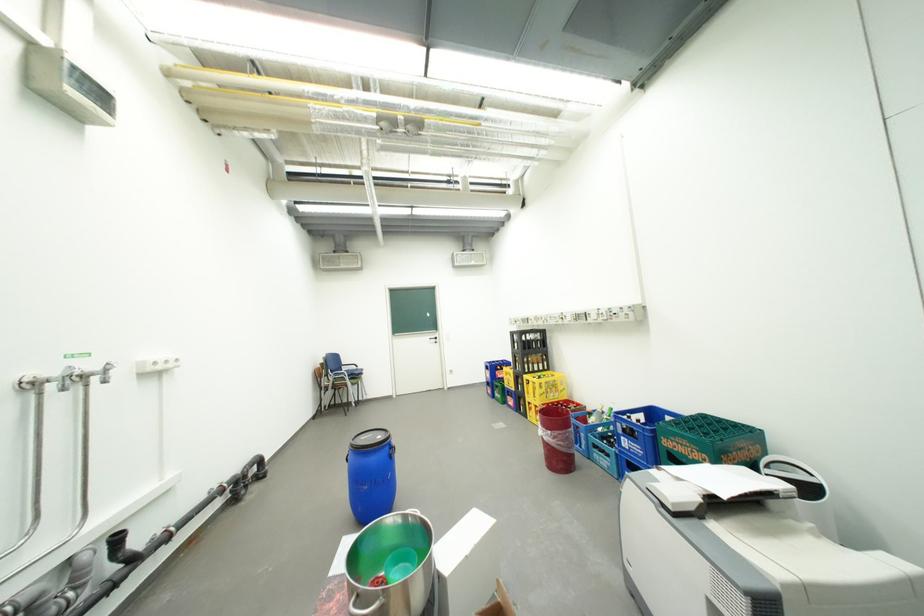
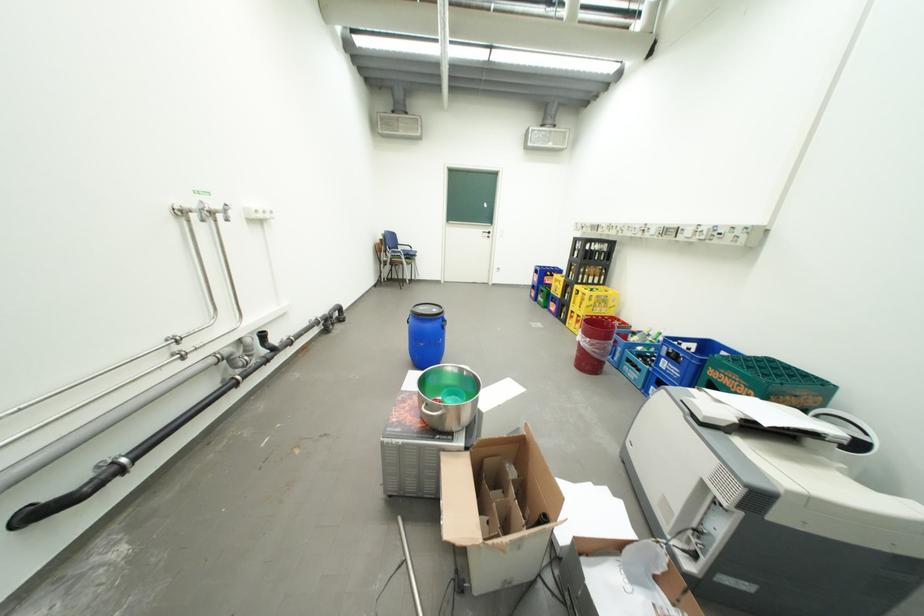
The point at (560, 434) is marked in the first image. Where is the corresponding point in the second image?

(599, 341)